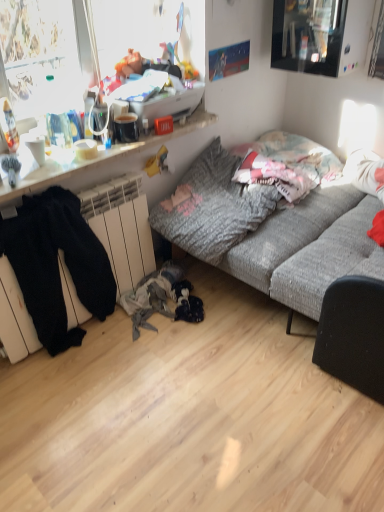
Question: Is textured gray couch at center not close to black cotton pants at lower left?

Choices:
 (A) yes
 (B) no

Answer: (B)

Question: Can you confirm if textured gray couch at center is bigger than black cotton pants at lower left?

Choices:
 (A) no
 (B) yes

Answer: (B)

Question: Considering the relative sizes of textured gray couch at center and black cotton pants at lower left in the image provided, is textured gray couch at center smaller than black cotton pants at lower left?

Choices:
 (A) no
 (B) yes

Answer: (A)

Question: Can you confirm if textured gray couch at center is thinner than black cotton pants at lower left?

Choices:
 (A) no
 (B) yes

Answer: (A)

Question: Considering the relative positions of textured gray couch at center and black cotton pants at lower left in the image provided, is textured gray couch at center behind black cotton pants at lower left?

Choices:
 (A) no
 (B) yes

Answer: (A)

Question: From a real-world perspective, relative to gray textured pillow at center, is black cotton pants at lower left vertically above or below?

Choices:
 (A) above
 (B) below

Answer: (B)

Question: Considering the positions of black cotton pants at lower left and gray textured pillow at center in the image, is black cotton pants at lower left taller or shorter than gray textured pillow at center?

Choices:
 (A) tall
 (B) short

Answer: (A)

Question: In the image, is black cotton pants at lower left positioned in front of or behind gray textured pillow at center?

Choices:
 (A) behind
 (B) front

Answer: (B)

Question: Considering the positions of point (34, 292) and point (216, 199), is point (34, 292) closer or farther from the camera than point (216, 199)?

Choices:
 (A) closer
 (B) farther

Answer: (A)

Question: Is gray textured pillow at center wider or thinner than white glossy bowl at upper left?

Choices:
 (A) thin
 (B) wide

Answer: (B)

Question: Would you say gray textured pillow at center is to the left or to the right of white glossy bowl at upper left in the picture?

Choices:
 (A) right
 (B) left

Answer: (A)

Question: From their relative heights in the image, would you say gray textured pillow at center is taller or shorter than white glossy bowl at upper left?

Choices:
 (A) short
 (B) tall

Answer: (B)

Question: Considering their positions, is gray textured pillow at center located in front of or behind white glossy bowl at upper left?

Choices:
 (A) behind
 (B) front

Answer: (B)

Question: Considering the relative positions of textured gray couch at center and black cotton pants at lower left in the image provided, is textured gray couch at center to the left or to the right of black cotton pants at lower left?

Choices:
 (A) right
 (B) left

Answer: (A)

Question: From the image's perspective, relative to black cotton pants at lower left, is textured gray couch at center above or below?

Choices:
 (A) above
 (B) below

Answer: (A)